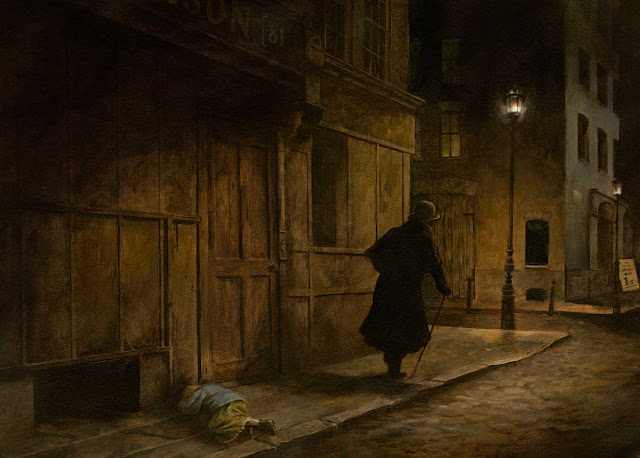
The width and height of the screenshot is (640, 458). I want to click on coat, so click(x=385, y=297).